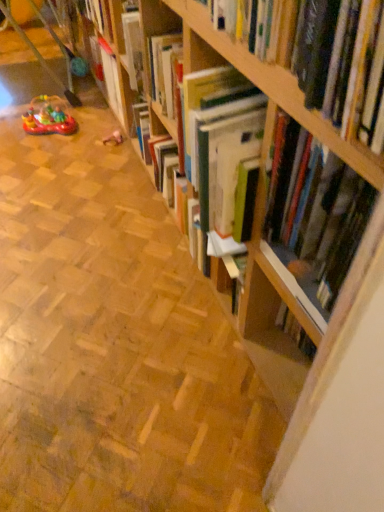
The image size is (384, 512). Find the location of `vacant area that is in front of rubberized plastic toy at center, the second toy in the left-to-right sequence`. vacant area that is in front of rubberized plastic toy at center, the second toy in the left-to-right sequence is located at coordinates (110, 162).